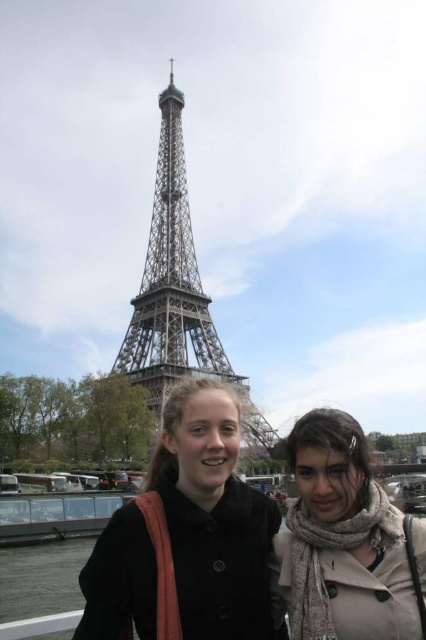
You are a photographer standing at the Eiffel Tower and notice the black matte coat at center and the beige textured scarf at lower right in your frame. Which object should you adjust your camera focus to ensure the foreground subject is sharp?

The black matte coat at center is in front of the beige textured scarf at lower right, so you should focus on the black matte coat at center to ensure the foreground subject is sharp.

Consider the image. You are a photographer trying to capture a photo of the metallic gray tower at center without the black matte coat at center blocking the view. Where should you position yourself relative to the current camera angle to ensure the tower is fully visible?

To avoid the black matte coat at center blocking the view of the metallic gray tower at center, you should move to the left of the current camera angle since the black matte coat at center is positioned to the right of the tower.

You are a photographer trying to capture a photo of the two people in front of the Eiffel Tower. You want to ensure both the black matte coat at center and the beige textured scarf at lower right are clearly visible. Based on their positions, which object is closer to the left side of the frame?

The black matte coat at center is positioned on the left side of the beige textured scarf at lower right, so the black matte coat at center is closer to the left side of the frame.